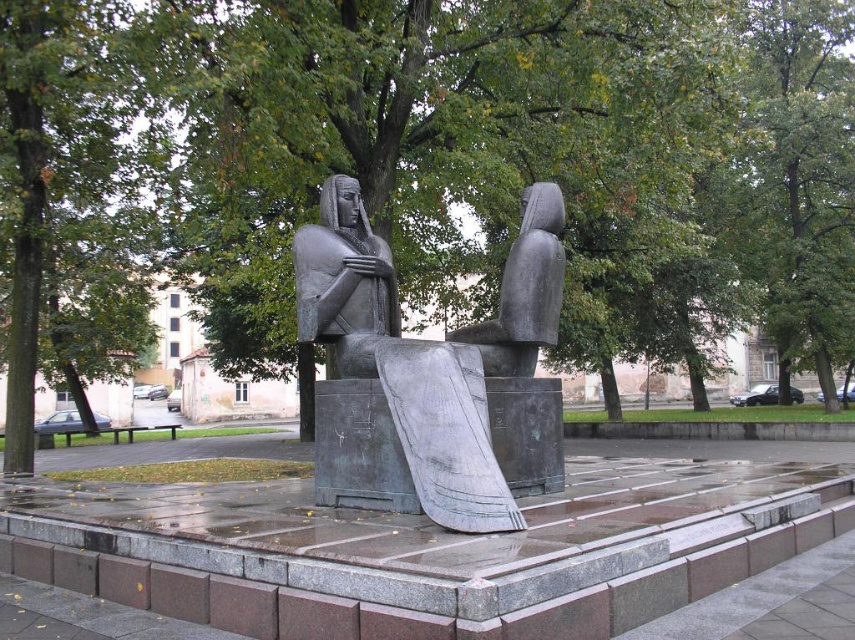
Question: Is green leafy tree at center further to camera compared to polished bronze statue at center?

Choices:
 (A) yes
 (B) no

Answer: (A)

Question: From the image, what is the correct spatial relationship of green leafy tree at center in relation to bronze statue at center?

Choices:
 (A) above
 (B) below

Answer: (A)

Question: Among these points, which one is farthest from the camera?

Choices:
 (A) (541, 184)
 (B) (482, 211)

Answer: (B)

Question: Which of the following is the farthest from the observer?

Choices:
 (A) (342, 260)
 (B) (638, 291)
 (C) (503, 314)

Answer: (B)

Question: Does green leafy tree at center appear under bronze statue at center?

Choices:
 (A) yes
 (B) no

Answer: (B)

Question: Among these objects, which one is farthest from the camera?

Choices:
 (A) polished bronze statue at center
 (B) green leafy tree at center

Answer: (B)